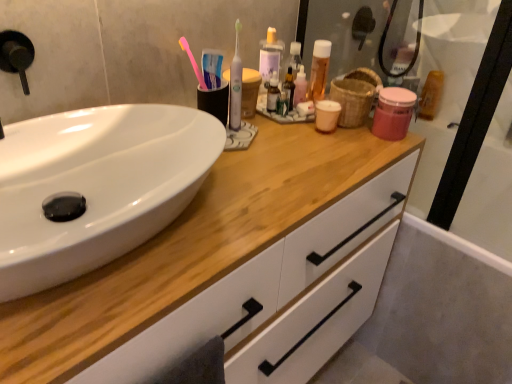
Identify the location of free space in front of pink matte jar at upper right, which is the second mouthwash in right-to-left order. (372, 156).